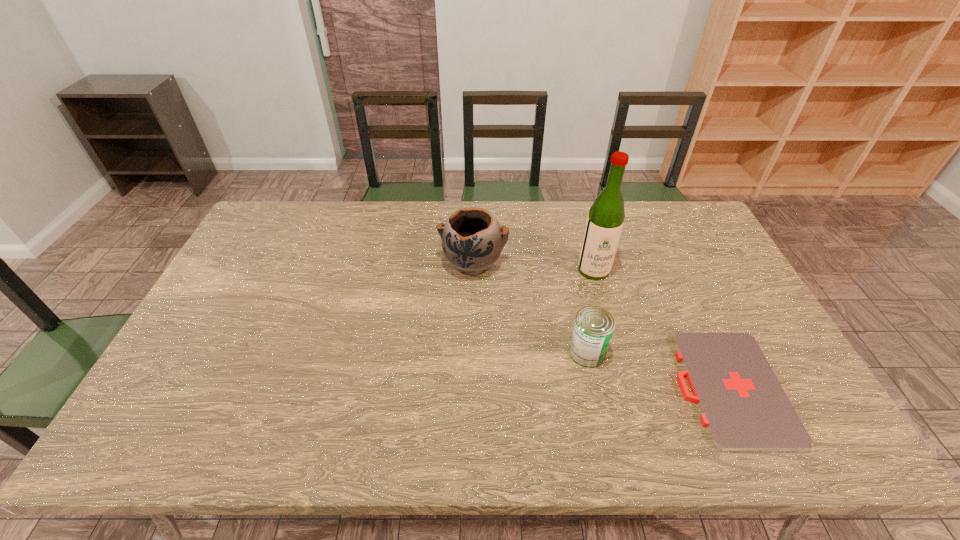
Locate which object is the third closest to the shortest object. Please provide its 2D coordinates. Your answer should be formatted as a tuple, i.e. [(x, y)], where the tuple contains the x and y coordinates of a point satisfying the conditions above.

[(472, 240)]

At what (x,y) coordinates should I click in order to perform the action: click on the third closest object to the tallest object. Please return your answer as a coordinate pair (x, y). The height and width of the screenshot is (540, 960). Looking at the image, I should click on (743, 406).

Where is `free space in the image that satisfies the following two spatial constraints: 1. on the front side of the third tallest object; 2. on the right side of the leftmost object`? free space in the image that satisfies the following two spatial constraints: 1. on the front side of the third tallest object; 2. on the right side of the leftmost object is located at coordinates (471, 353).

At what (x,y) coordinates should I click in order to perform the action: click on free space that satisfies the following two spatial constraints: 1. on the front side of the third tallest object; 2. on the left side of the pottery. Please return your answer as a coordinate pair (x, y). The width and height of the screenshot is (960, 540). Looking at the image, I should click on (471, 353).